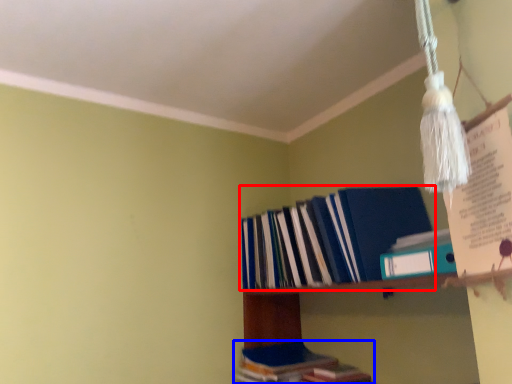
Question: Which of the following is the farthest to the observer, book (highlighted by a red box) or book (highlighted by a blue box)?

Choices:
 (A) book
 (B) book

Answer: (B)